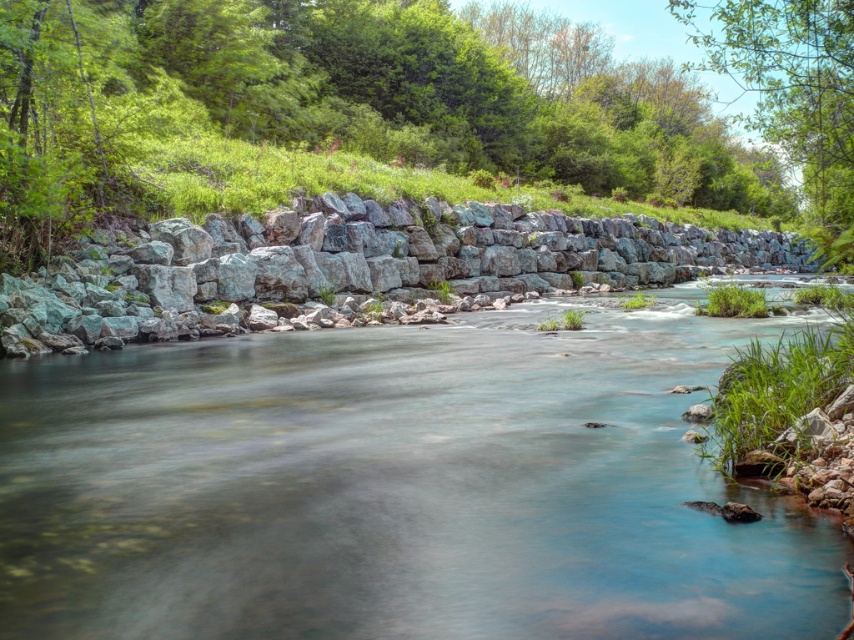
You are a photographer planning to capture the gray rock wall at center and the green leafy tree at upper right in a single frame. Based on their sizes, which object will appear smaller in the photo?

The gray rock wall at center will appear smaller in the photo because it is thinner than the green leafy tree at upper right.

Looking at this image, you are standing at the riverbank and want to place a small marker at both point (407, 243) and point (796, 83). Which point is closer to you when you are facing the river?

Point (407, 243) is closer to you than point (796, 83) because it is further to the viewer.